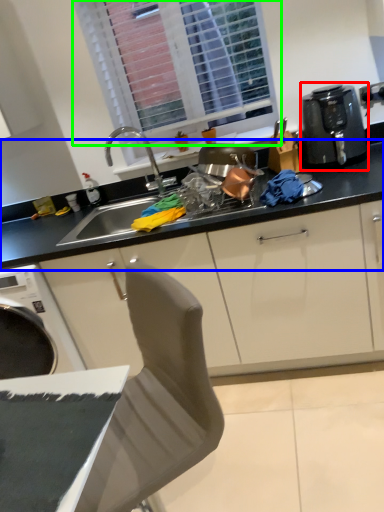
Question: Considering the real-world distances, which object is closest to kitchen appliance (highlighted by a red box)? countertop (highlighted by a blue box) or window (highlighted by a green box).

Choices:
 (A) countertop
 (B) window

Answer: (A)